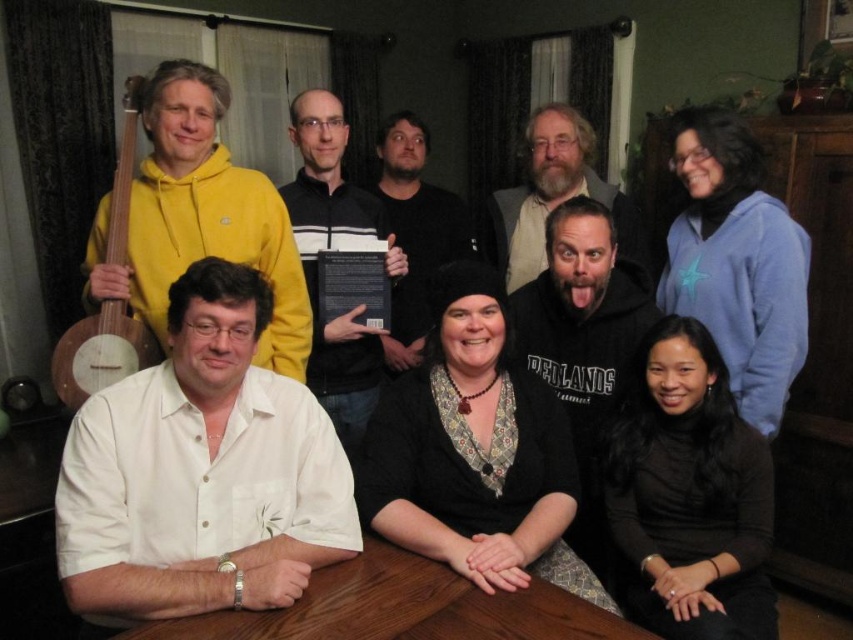
Question: Does brown wooden table at center have a smaller size compared to black paper at center?

Choices:
 (A) yes
 (B) no

Answer: (B)

Question: Which point appears farthest from the camera in this image?

Choices:
 (A) (354, 291)
 (B) (363, 636)

Answer: (A)

Question: Can you confirm if brown wooden table at center is positioned to the right of black paper at center?

Choices:
 (A) yes
 (B) no

Answer: (A)

Question: Does brown wooden table at center appear on the right side of black paper at center?

Choices:
 (A) no
 (B) yes

Answer: (B)